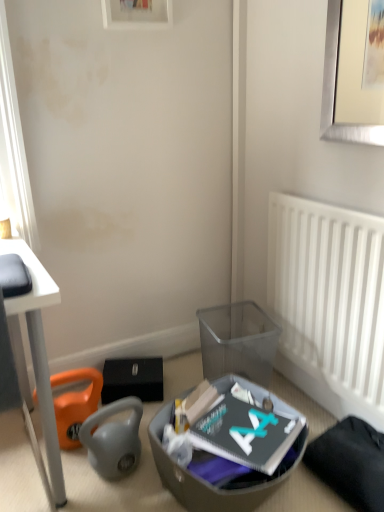
Question: Is translucent plastic shoe box at lower center touching orange fabric bean bag chair at lower left?

Choices:
 (A) yes
 (B) no

Answer: (B)

Question: Is translucent plastic shoe box at lower center smaller than orange fabric bean bag chair at lower left?

Choices:
 (A) no
 (B) yes

Answer: (A)

Question: Is translucent plastic shoe box at lower center at the left side of orange fabric bean bag chair at lower left?

Choices:
 (A) no
 (B) yes

Answer: (A)

Question: From the image's perspective, is translucent plastic shoe box at lower center located beneath orange fabric bean bag chair at lower left?

Choices:
 (A) no
 (B) yes

Answer: (B)

Question: From a real-world perspective, is translucent plastic shoe box at lower center beneath orange fabric bean bag chair at lower left?

Choices:
 (A) yes
 (B) no

Answer: (A)

Question: Is transparent plastic trash bin/can at lower center inside the boundaries of translucent plastic shoe box at lower center, or outside?

Choices:
 (A) inside
 (B) outside

Answer: (B)

Question: Is transparent plastic trash bin/can at lower center bigger or smaller than translucent plastic shoe box at lower center?

Choices:
 (A) big
 (B) small

Answer: (B)

Question: Based on their positions, is transparent plastic trash bin/can at lower center located to the left or right of translucent plastic shoe box at lower center?

Choices:
 (A) right
 (B) left

Answer: (A)

Question: Considering the positions of point (220, 352) and point (246, 394), is point (220, 352) closer or farther from the camera than point (246, 394)?

Choices:
 (A) closer
 (B) farther

Answer: (B)

Question: From the image's perspective, is white plastic radiator at right above or below translucent plastic shoe box at lower center?

Choices:
 (A) above
 (B) below

Answer: (A)

Question: From a real-world perspective, is white plastic radiator at right positioned above or below translucent plastic shoe box at lower center?

Choices:
 (A) below
 (B) above

Answer: (B)

Question: Is white plastic radiator at right wider or thinner than translucent plastic shoe box at lower center?

Choices:
 (A) wide
 (B) thin

Answer: (B)

Question: Considering their positions, is white plastic radiator at right located in front of or behind translucent plastic shoe box at lower center?

Choices:
 (A) front
 (B) behind

Answer: (B)

Question: Looking at the image, does transparent plastic trash bin/can at lower center seem bigger or smaller compared to orange fabric bean bag chair at lower left?

Choices:
 (A) small
 (B) big

Answer: (B)

Question: Considering their positions, is transparent plastic trash bin/can at lower center located in front of or behind orange fabric bean bag chair at lower left?

Choices:
 (A) front
 (B) behind

Answer: (B)